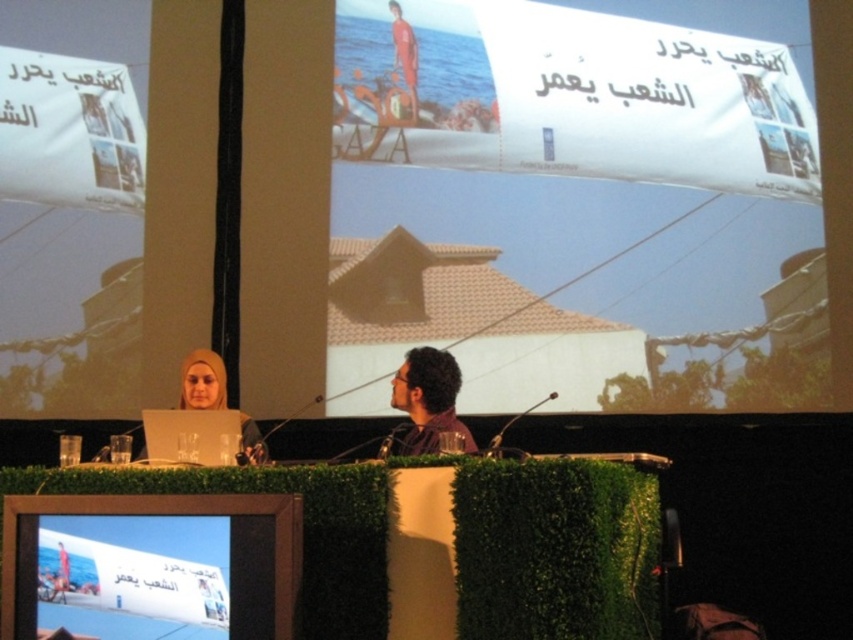
Can you confirm if white paper at upper center is positioned above matte beige hijab at center?

Indeed, white paper at upper center is positioned over matte beige hijab at center.

Describe the element at coordinates (582, 205) in the screenshot. I see `white paper at upper center` at that location.

Where is `white paper at upper center`? The image size is (853, 640). white paper at upper center is located at coordinates (582, 205).

Between point (534, 60) and point (433, 387), which one is positioned in front?

Point (433, 387) is more forward.

Between point (544, 195) and point (408, 362), which one is positioned behind?

The point (544, 195) is more distant.

Locate an element on the screen. white paper at upper center is located at coordinates (582, 205).

Is matte beige hijab at center in front of orange life vest at upper center?

Yes, it is.

Which is behind, point (251, 429) or point (410, 67)?

Point (410, 67)

Is point (242, 429) behind point (397, 26)?

That is False.

Locate an element on the screen. The height and width of the screenshot is (640, 853). matte beige hijab at center is located at coordinates (202, 381).